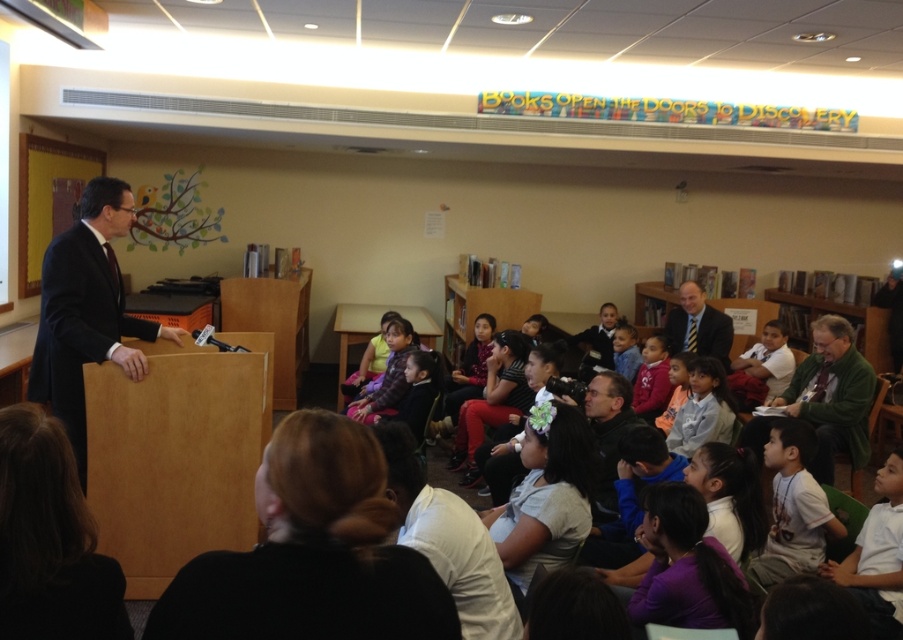
Question: Can you confirm if green wool sweater at right is smaller than pink fabric dress at center?

Choices:
 (A) no
 (B) yes

Answer: (A)

Question: Which of the following is the farthest from the observer?

Choices:
 (A) (796, 460)
 (B) (634, 372)
 (C) (445, 396)
 (D) (687, 426)

Answer: (B)

Question: Among these objects, which one is nearest to the camera?

Choices:
 (A) matte pink hoodie at center
 (B) pink fabric dress at center
 (C) light brown hair at center
 (D) white t-shirt at lower right

Answer: (D)

Question: Can you confirm if light brown hair at lower right is smaller than matte pink sweater at center?

Choices:
 (A) no
 (B) yes

Answer: (B)

Question: Which object appears farthest from the camera in this image?

Choices:
 (A) light brown hair at lower right
 (B) light blue shirt at center

Answer: (B)

Question: Is matte pink hoodie at center further to the viewer compared to pink fabric dress at center?

Choices:
 (A) yes
 (B) no

Answer: (B)